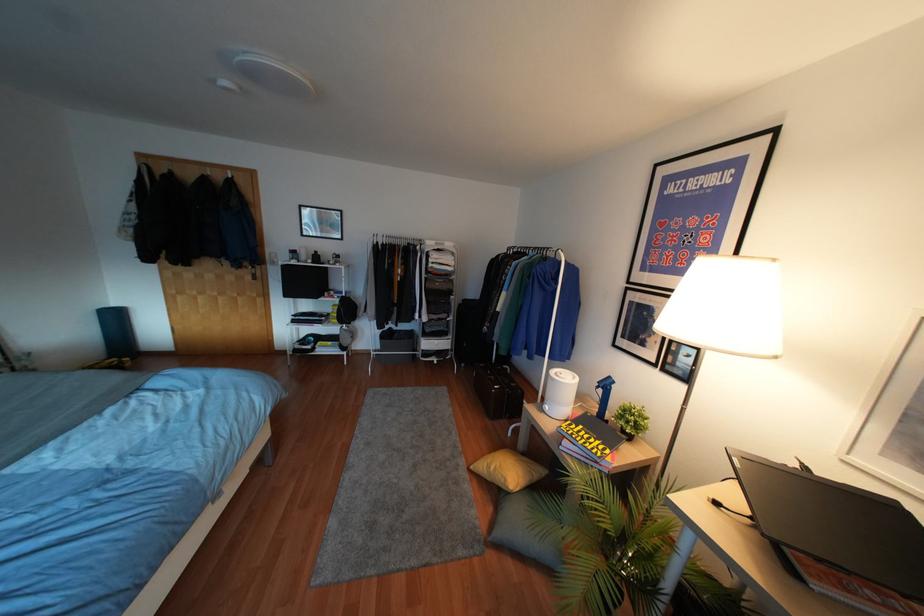
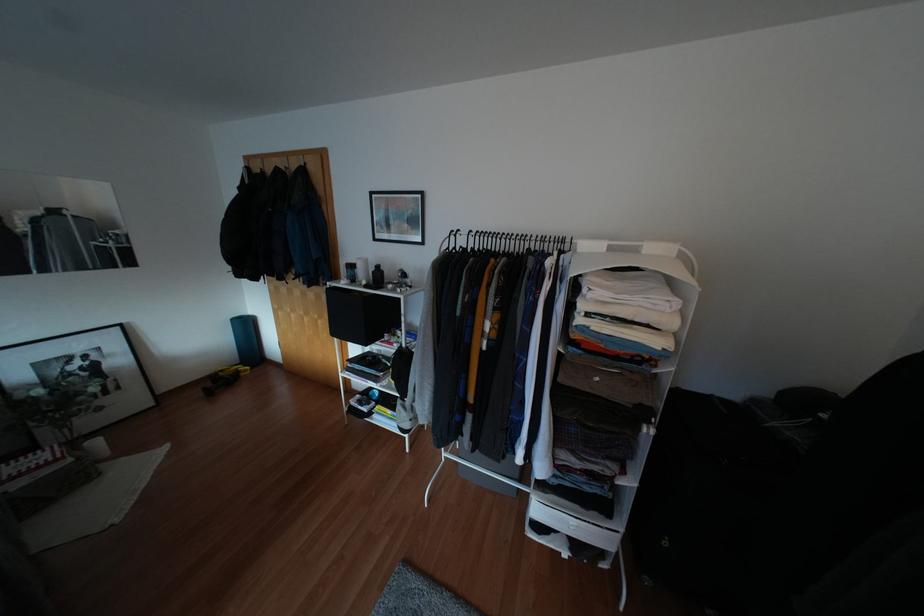
The point at (x=115, y=315) is marked in the first image. Where is the corresponding point in the second image?

(246, 325)